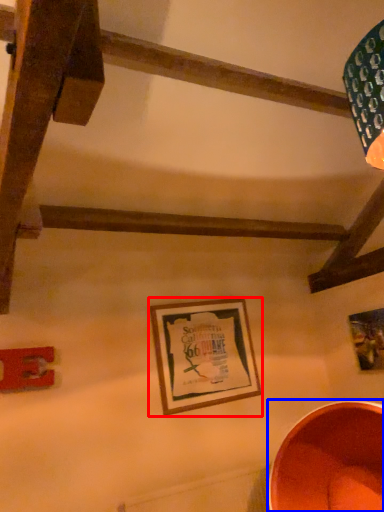
Question: Which object is further to the camera taking this photo, picture frame (highlighted by a red box) or basin (highlighted by a blue box)?

Choices:
 (A) picture frame
 (B) basin

Answer: (A)